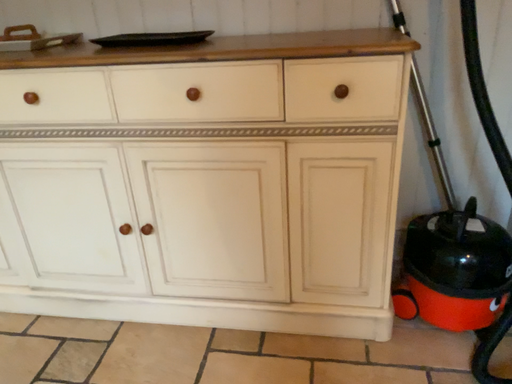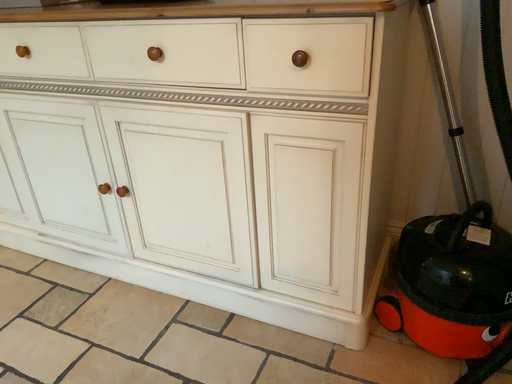
Question: How did the camera likely rotate when shooting the video?

Choices:
 (A) rotated left
 (B) rotated right

Answer: (A)